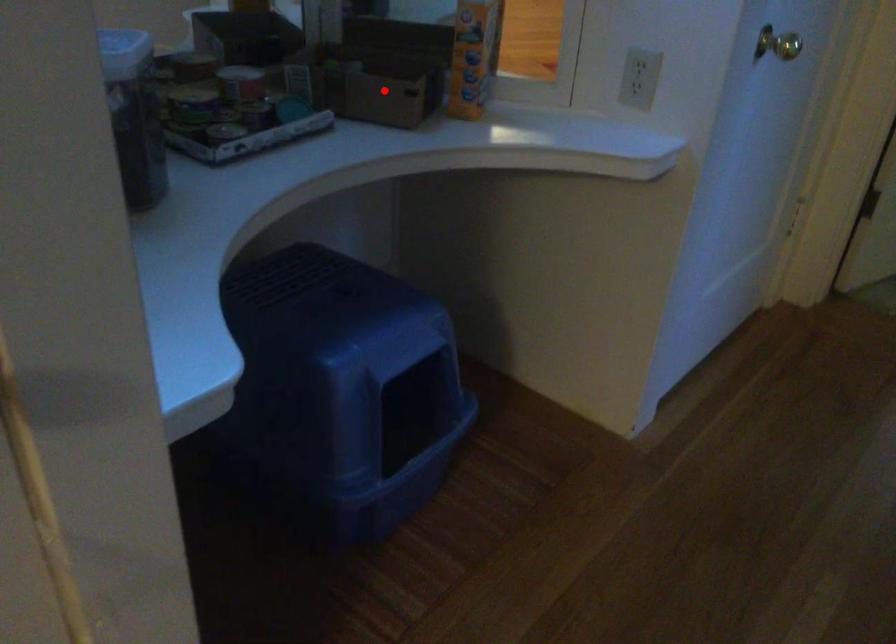
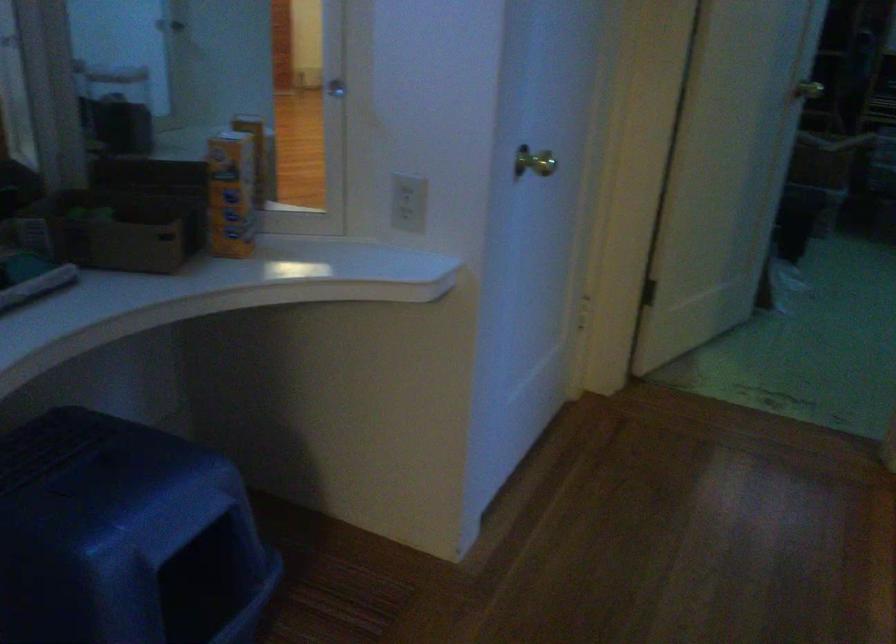
In the second image, find the point that corresponds to the highlighted location in the first image.

(138, 238)